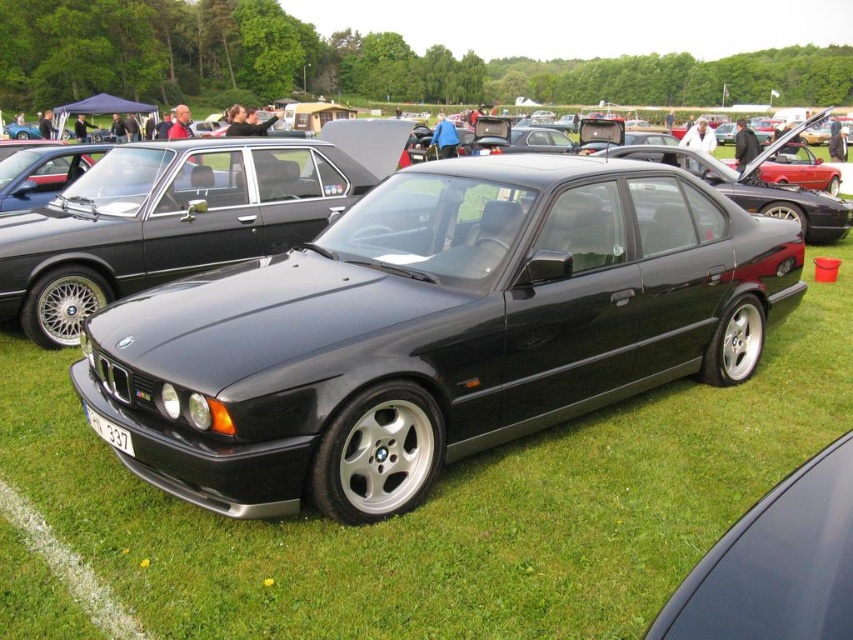
You are standing in front of the BMW E34 sedan at the car show and want to take a photo. You notice two points on the car, one at point coordinates point (144, 275) and another at point coordinates point (91, 417). Which point is closer to you?

The point at coordinates point (144, 275) is closer to you than the point at coordinates point (91, 417) because it is further to the viewer.

You are a photographer trying to capture a clear shot of the black metallic sedan at center and the white plastic license plate at lower center. What is the minimum distance you need to maintain between the camera and the license plate to ensure both are in focus?

The minimum distance required is 3.25 meters between the camera and the white plastic license plate at lower center to ensure both the black metallic sedan at center and the white plastic license plate at lower center are in focus.